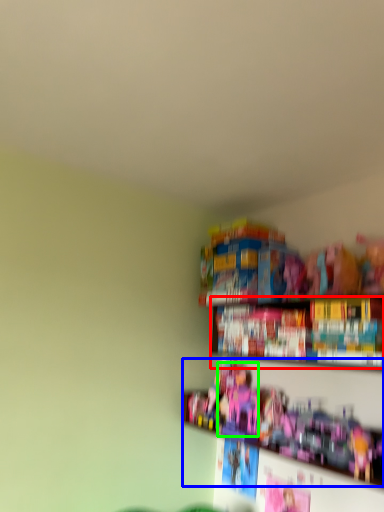
Question: Which object is the farthest from book (highlighted by a red box)? Choose among these: toy (highlighted by a blue box) or toy (highlighted by a green box).

Choices:
 (A) toy
 (B) toy

Answer: (B)